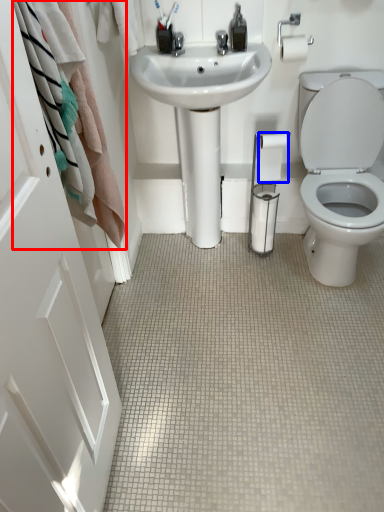
Question: Which object appears farthest to the camera in this image, bath towel (highlighted by a red box) or toilet paper (highlighted by a blue box)?

Choices:
 (A) bath towel
 (B) toilet paper

Answer: (B)